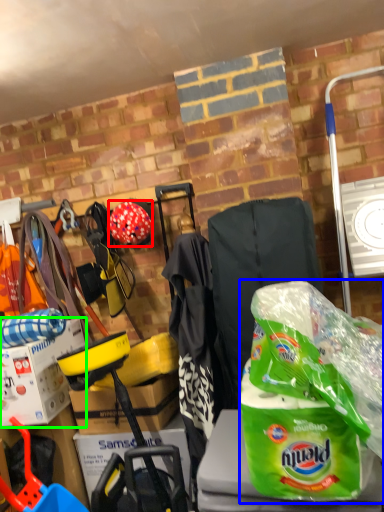
Question: Which object is the closest to the helmet (highlighted by a red box)? Choose among these: plastic bag (highlighted by a blue box) or box (highlighted by a green box).

Choices:
 (A) plastic bag
 (B) box

Answer: (B)